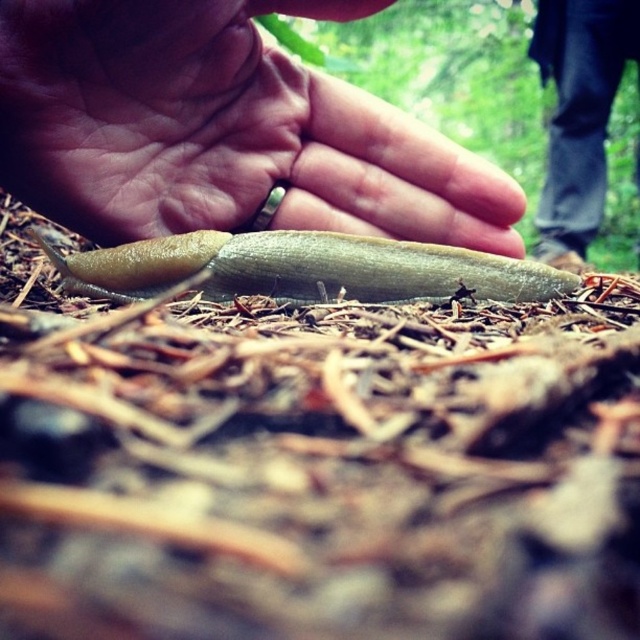
Can you confirm if matte gold ring at center is bigger than green slimy snail at center?

Indeed, matte gold ring at center has a larger size compared to green slimy snail at center.

Which is in front, point (515, 200) or point (250, 275)?

Point (250, 275) is in front.

At what (x,y) coordinates should I click in order to perform the action: click on matte gold ring at center. Please return your answer as a coordinate pair (x, y). Image resolution: width=640 pixels, height=640 pixels. Looking at the image, I should click on (221, 129).